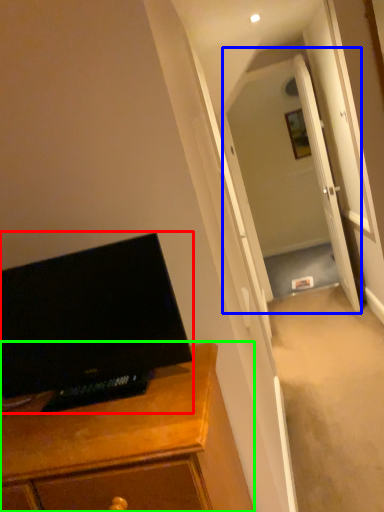
Question: Estimate the real-world distances between objects in this image. Which object is closer to computer monitor (highlighted by a red box), glass door (highlighted by a blue box) or cabinetry (highlighted by a green box)?

Choices:
 (A) glass door
 (B) cabinetry

Answer: (B)